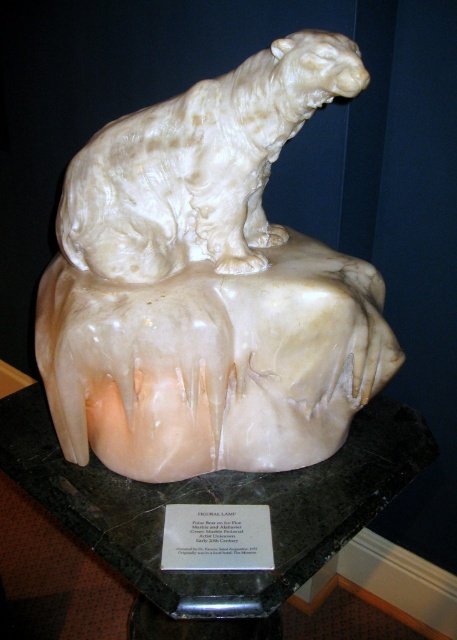
Question: In this image, where is white marble lion at center located relative to white marble lion at upper center?

Choices:
 (A) left
 (B) right

Answer: (B)

Question: Is white marble lion at center above white marble lion at upper center?

Choices:
 (A) no
 (B) yes

Answer: (A)

Question: Which of the following is the farthest from the observer?

Choices:
 (A) (272, 236)
 (B) (324, 445)

Answer: (A)

Question: Which object appears closest to the camera in this image?

Choices:
 (A) white marble lion at center
 (B) white marble lion at upper center

Answer: (B)

Question: Among these objects, which one is farthest from the camera?

Choices:
 (A) white marble lion at upper center
 (B) white marble lion at center

Answer: (B)

Question: Is white marble lion at center below white marble lion at upper center?

Choices:
 (A) yes
 (B) no

Answer: (A)